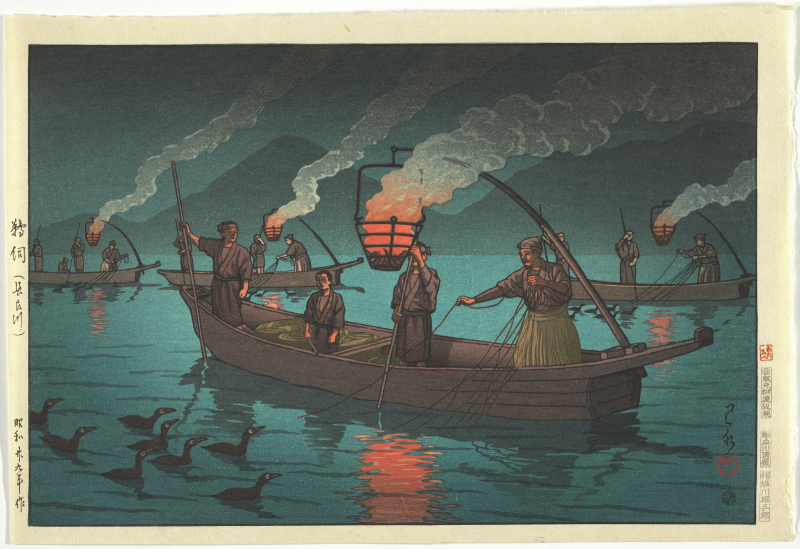
Identify the location of lantern. The image size is (800, 549). (90, 233), (386, 229), (658, 225).